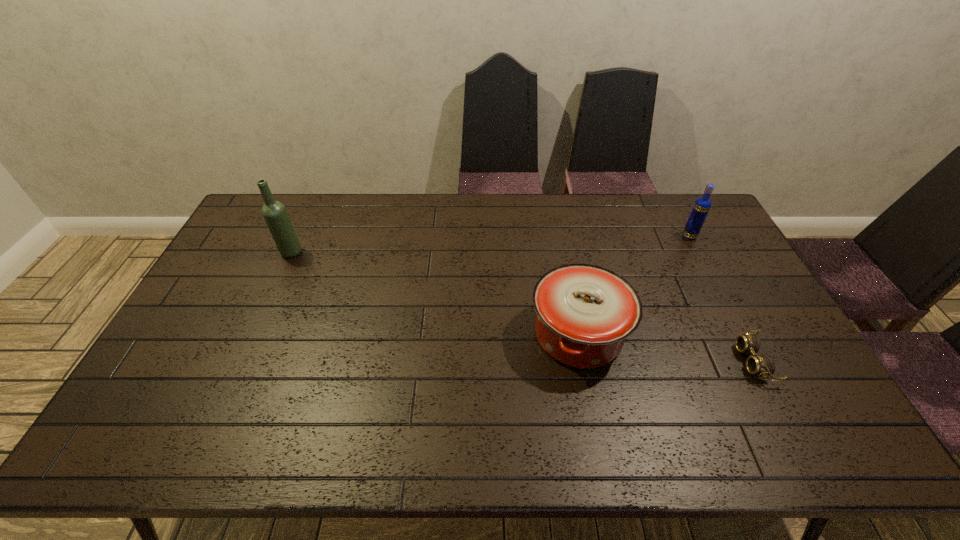
Identify the location of vacant point located between the shortest object and the vodka. (721, 299).

I want to click on free space between the tallest object and the casserole, so click(435, 293).

Image resolution: width=960 pixels, height=540 pixels. In order to click on free space between the farthest object and the shortest object in this screenshot , I will do `click(721, 299)`.

This screenshot has width=960, height=540. Identify the location of object that is the nearest to the casserole. (762, 365).

Locate an element on the screen. the closest object to the shortest object is located at coordinates (585, 312).

You are a GUI agent. You are given a task and a screenshot of the screen. Output one action in this format:
    pyautogui.click(x=<x>, y=<y>)
    Task: Click on the free spot that satisfies the following two spatial constraints: 1. on the front side of the casserole; 2. on the left side of the second farthest object
    Image resolution: width=960 pixels, height=540 pixels.
    Given the screenshot: What is the action you would take?
    pyautogui.click(x=253, y=334)

This screenshot has height=540, width=960. Find the location of `vacant space that satisfies the following two spatial constraints: 1. on the front side of the vodka; 2. through the lenses of the shortest object`. vacant space that satisfies the following two spatial constraints: 1. on the front side of the vodka; 2. through the lenses of the shortest object is located at coordinates click(x=755, y=361).

Locate an element on the screen. The image size is (960, 540). free space that satisfies the following two spatial constraints: 1. on the front side of the third object from right to left; 2. on the right side of the third nearest object is located at coordinates (253, 334).